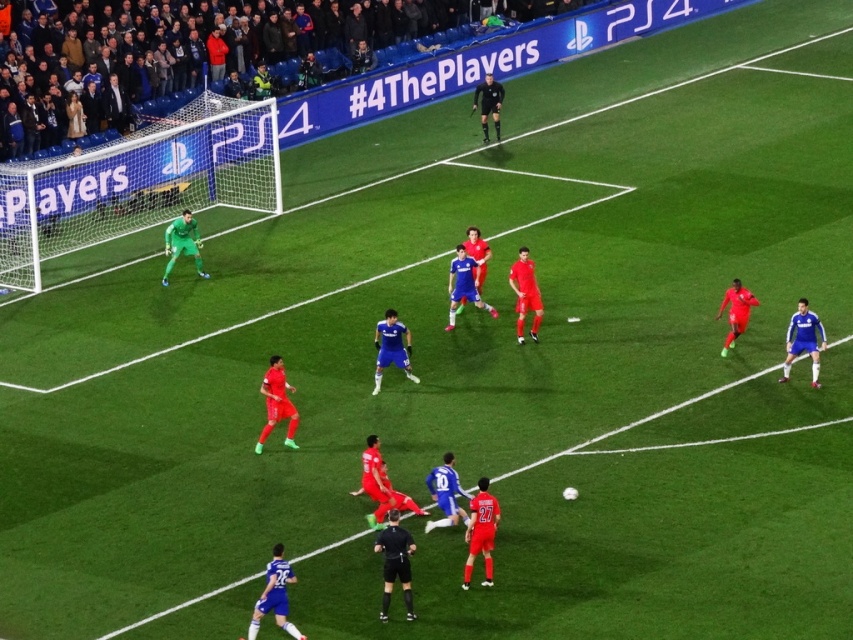
Does blue jersey player at center lie behind blue matte jersey at center?

No.

Does point (578, 445) lie in front of point (397, 336)?

Yes.

Which is behind, point (505, 476) or point (380, 342)?

Point (380, 342)

Where is `blue jersey player at center`? The height and width of the screenshot is (640, 853). blue jersey player at center is located at coordinates (636, 422).

Can you confirm if blue jersey player at center is positioned above shiny red jersey at center?

No, blue jersey player at center is not above shiny red jersey at center.

The height and width of the screenshot is (640, 853). What are the coordinates of `blue jersey player at center` in the screenshot? It's located at (636, 422).

Can you confirm if blue matte jersey at center is taller than black matte referee at center?

No, blue matte jersey at center is not taller than black matte referee at center.

Between point (384, 314) and point (502, 88), which one is positioned in front?

Point (384, 314) is more forward.

Between point (404, 348) and point (498, 128), which one is positioned behind?

The point (498, 128) is behind.

Identify the location of blue matte jersey at center. (392, 348).